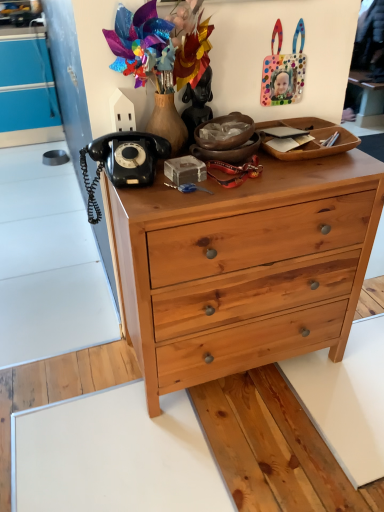
Question: Is black rubberized telephone at upper left oriented towards black matte statue at upper center?

Choices:
 (A) no
 (B) yes

Answer: (A)

Question: Is black matte statue at upper center located within black rubberized telephone at upper left?

Choices:
 (A) yes
 (B) no

Answer: (B)

Question: Is black rubberized telephone at upper left to the left of black matte statue at upper center from the viewer's perspective?

Choices:
 (A) no
 (B) yes

Answer: (B)

Question: Can you confirm if black rubberized telephone at upper left is thinner than black matte statue at upper center?

Choices:
 (A) no
 (B) yes

Answer: (A)

Question: From a real-world perspective, does black rubberized telephone at upper left stand above black matte statue at upper center?

Choices:
 (A) no
 (B) yes

Answer: (A)

Question: From the image's perspective, relative to natural wood chest of drawers at center, is polka dot plastic handbag at upper right above or below?

Choices:
 (A) below
 (B) above

Answer: (B)

Question: Is polka dot plastic handbag at upper right wider or thinner than natural wood chest of drawers at center?

Choices:
 (A) wide
 (B) thin

Answer: (B)

Question: Choose the correct answer: Is polka dot plastic handbag at upper right inside natural wood chest of drawers at center or outside it?

Choices:
 (A) outside
 (B) inside

Answer: (A)

Question: From a real-world perspective, is polka dot plastic handbag at upper right physically located above or below natural wood chest of drawers at center?

Choices:
 (A) below
 (B) above

Answer: (B)

Question: From a real-world perspective, is polka dot plastic handbag at upper right above or below black rubberized telephone at upper left?

Choices:
 (A) below
 (B) above

Answer: (B)

Question: Based on their sizes in the image, would you say polka dot plastic handbag at upper right is bigger or smaller than black rubberized telephone at upper left?

Choices:
 (A) small
 (B) big

Answer: (A)

Question: Is polka dot plastic handbag at upper right in front of or behind black rubberized telephone at upper left in the image?

Choices:
 (A) behind
 (B) front

Answer: (A)

Question: Is polka dot plastic handbag at upper right to the left or to the right of black rubberized telephone at upper left in the image?

Choices:
 (A) right
 (B) left

Answer: (A)

Question: In the image, is black matte statue at upper center positioned in front of or behind black rubberized telephone at upper left?

Choices:
 (A) behind
 (B) front

Answer: (A)

Question: Is black matte statue at upper center to the left or to the right of black rubberized telephone at upper left in the image?

Choices:
 (A) left
 (B) right

Answer: (B)